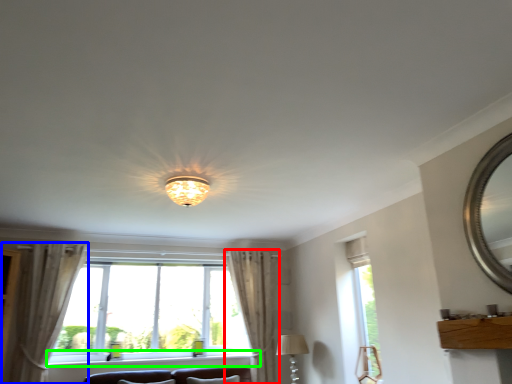
Question: Which object is positioned closest to curtain (highlighted by a red box)? Select from curtain (highlighted by a blue box) and window sill (highlighted by a green box).

Choices:
 (A) curtain
 (B) window sill

Answer: (B)